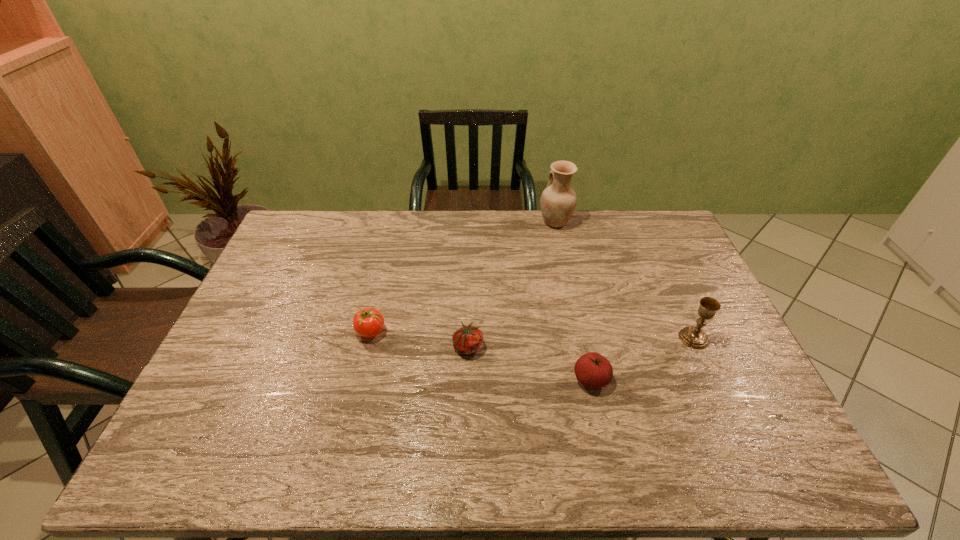
This screenshot has width=960, height=540. What are the coordinates of `empty location between the tallest object and the leftmost object` in the screenshot? It's located at (463, 277).

You are a GUI agent. You are given a task and a screenshot of the screen. Output one action in this format:
    pyautogui.click(x=<x>, y=<y>)
    Task: Click on the third closest object relative to the shortest object
    
    Given the screenshot: What is the action you would take?
    pyautogui.click(x=558, y=201)

I want to click on object that is the closest to the leftmost object, so click(x=467, y=340).

Locate an element on the screen. the second closest tomato to the leftmost object is located at coordinates (593, 370).

Locate an element on the screen. This screenshot has width=960, height=540. tomato identified as the closest to the farthest object is located at coordinates (467, 340).

This screenshot has width=960, height=540. In order to click on free location that satisfies the following two spatial constraints: 1. on the front side of the nearest object; 2. on the right side of the leftmost tomato in this screenshot , I will do `click(359, 379)`.

The image size is (960, 540). I want to click on vacant region that satisfies the following two spatial constraints: 1. on the front side of the chalice; 2. on the right side of the pottery, so click(x=580, y=338).

Identify the location of free space that satisfies the following two spatial constraints: 1. on the front side of the farthest object; 2. on the left side of the fourth shortest object. (580, 338).